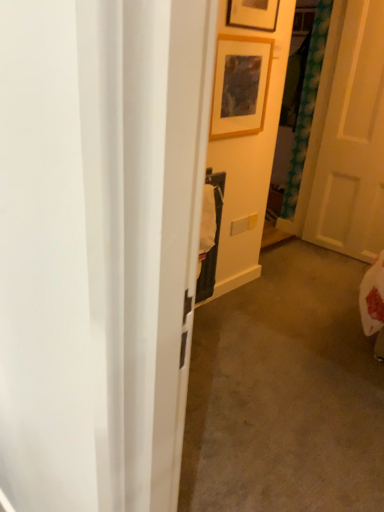
Question: Is wooden picture frame at upper center, the 1th picture frame when ordered from top to bottom, inside or outside of white matte door at right?

Choices:
 (A) inside
 (B) outside

Answer: (B)

Question: From a real-world perspective, is wooden picture frame at upper center, the 2th picture frame positioned from the bottom, positioned above or below white matte door at right?

Choices:
 (A) below
 (B) above

Answer: (B)

Question: Considering the real-world distances, which object is farthest from the wooden frame at upper center, the 2th picture frame from the top?

Choices:
 (A) white matte door at right
 (B) wooden picture frame at upper center, the 1th picture frame when ordered from top to bottom

Answer: (A)

Question: Based on their relative distances, which object is nearer to the wooden frame at upper center, placed as the first picture frame when sorted from bottom to top?

Choices:
 (A) white matte door at right
 (B) wooden picture frame at upper center, the 2th picture frame positioned from the bottom

Answer: (B)